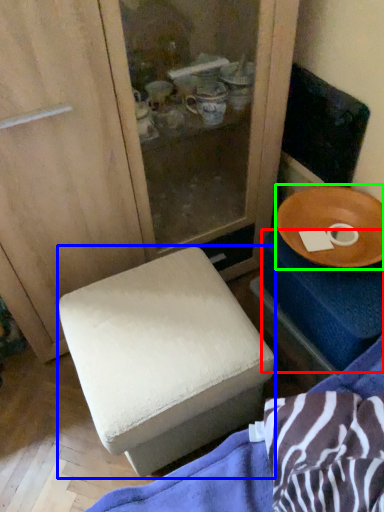
Question: Which is nearer to the changing table (highlighted by a red box)? furniture (highlighted by a blue box) or tableware (highlighted by a green box).

Choices:
 (A) furniture
 (B) tableware

Answer: (B)